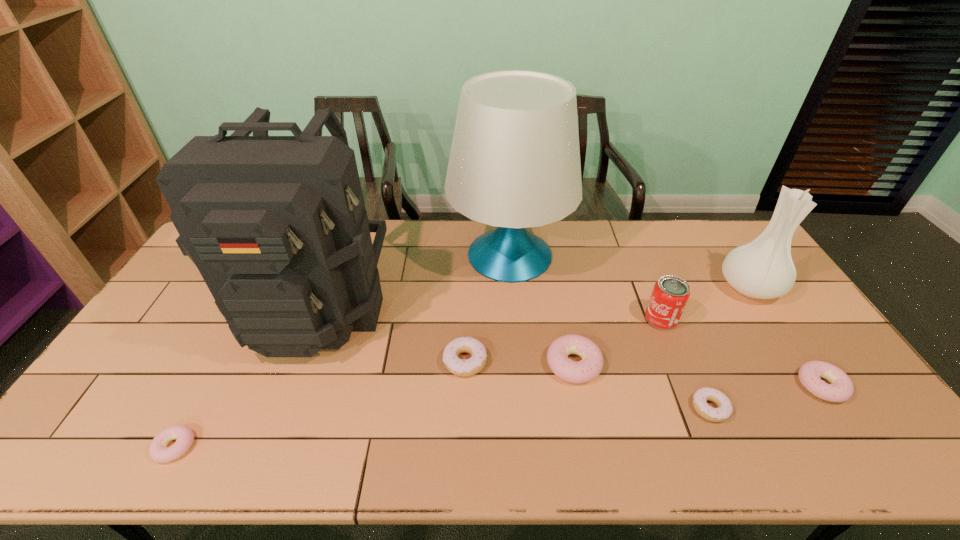
You are a GUI agent. You are given a task and a screenshot of the screen. Output one action in this format:
    pyautogui.click(x=<x>, y=<y>)
    Task: Click on the vase present at the right edge
    This screenshot has width=960, height=540.
    Given the screenshot: What is the action you would take?
    pyautogui.click(x=763, y=269)

Locate an element on the screen. doughnut located in the right edge section of the desktop is located at coordinates (841, 388).

Image resolution: width=960 pixels, height=540 pixels. Find the location of `free space at the far edge of the desktop`. free space at the far edge of the desktop is located at coordinates (400, 231).

You are a GUI agent. You are given a task and a screenshot of the screen. Output one action in this format:
    pyautogui.click(x=<x>, y=<y>)
    Task: Click on the vacant space at the near edge of the desktop
    This screenshot has width=960, height=540.
    Given the screenshot: What is the action you would take?
    (618, 435)

Locate an element on the screen. Image resolution: width=960 pixels, height=540 pixels. vacant space at the left edge is located at coordinates (156, 339).

What are the coordinates of `blank space at the right edge of the desktop` in the screenshot? It's located at (804, 318).

The image size is (960, 540). In the image, there is a desktop. Identify the location of vacant space at the far right corner. (699, 227).

Where is `vacant area that lies between the second pink doughnut from right to left and the white table lamp`? Image resolution: width=960 pixels, height=540 pixels. vacant area that lies between the second pink doughnut from right to left and the white table lamp is located at coordinates (541, 309).

Locate an element on the screen. The width and height of the screenshot is (960, 540). vacant space that is in between the rightmost pink doughnut and the biggest pink doughnut is located at coordinates (698, 375).

The width and height of the screenshot is (960, 540). In order to click on free space between the smallest pink doughnut and the biggest pink doughnut in this screenshot , I will do `click(374, 405)`.